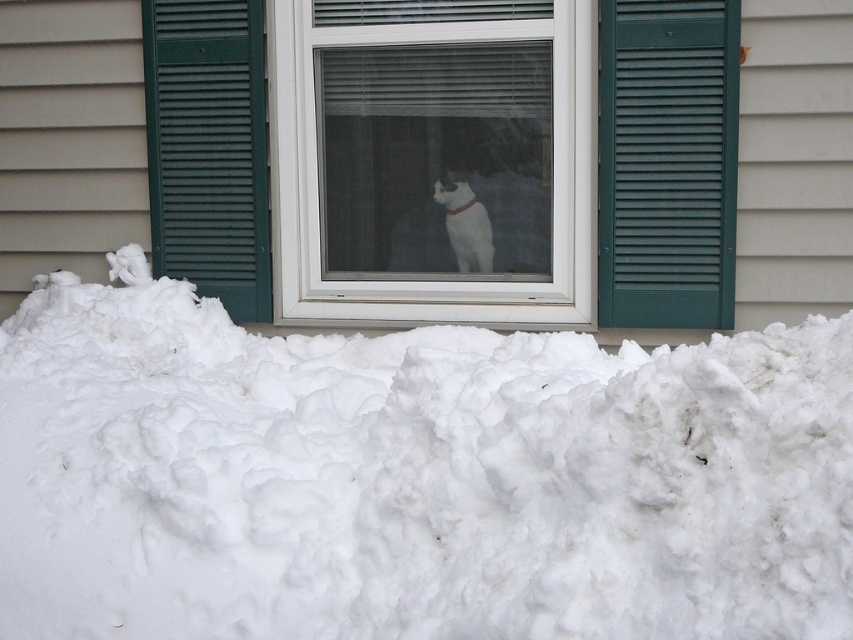
You are a delivery person trying to reach the door behind the green louvered shutter at center and the white fur dog at center. Which object is taller and would block your view more when approaching the door?

The green louvered shutter at center is much taller than the white fur dog at center, so it would block your view more when approaching the door.

You are a delivery person trying to reach the front door, which is behind the green painted wood shutter at right and the white fur dog at center. The path to the door is blocked by the snow. Which object should you move first to clear the path?

The green painted wood shutter at right has a greater height compared to white fur dog at center, so you should move the white fur dog at center first since it is shorter and easier to move out of the way.